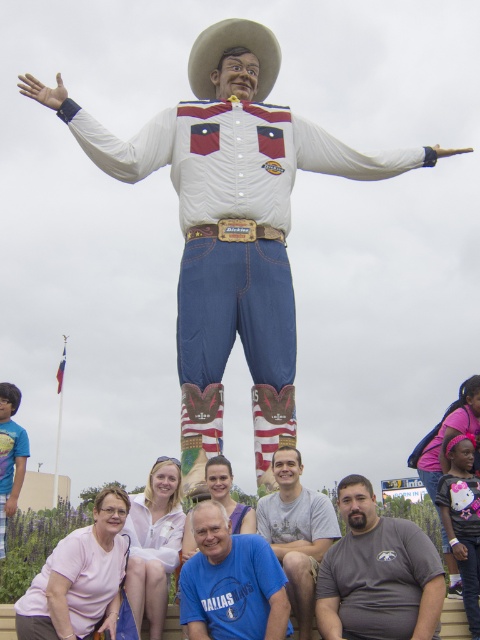
You are a photographer trying to capture a group photo of the people in front of the statue. The white matte cowboy at center and the gray matte shirt at lower center are blocking the view. Which object should you move to the right to get a clearer shot of the statue?

You should move the white matte cowboy at center to the right since it is positioned on the left side of the gray matte shirt at lower center, meaning moving it right would clear the view.

You are a photographer trying to capture a group photo of the people in front of the cowboy statue. You notice the gray matte shirt at lower center and the white felt cowboy hat at upper center. Which object is closer to the camera?

The gray matte shirt at lower center is positioned under the white felt cowboy hat at upper center, meaning the gray matte shirt is closer to the camera since it is lower in the image.